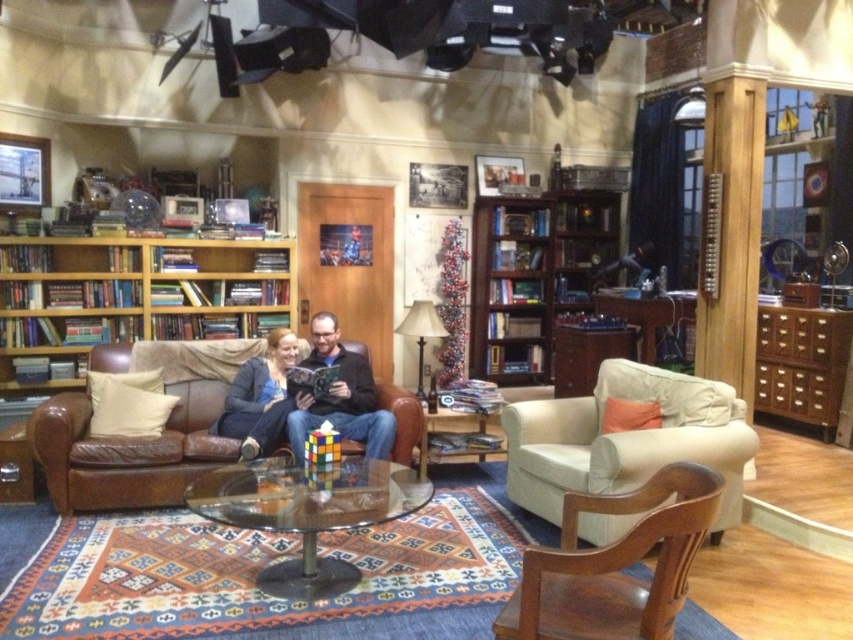
Question: Is brown leather couch at lower left below matte black sweater at left?

Choices:
 (A) yes
 (B) no

Answer: (A)

Question: Can you confirm if beige fabric armchair at center is positioned below light brown wood armchair at lower right?

Choices:
 (A) yes
 (B) no

Answer: (B)

Question: Based on their relative distances, which object is farther from the brown wooden bookcase at left?

Choices:
 (A) rubik's cube at center
 (B) beige fabric armchair at center
 (C) matte black sweater at left
 (D) brown leather couch at lower left

Answer: (B)

Question: Which object is positioned farthest from the beige fabric armchair at center?

Choices:
 (A) brown leather couch at lower left
 (B) matte black sweater at left
 (C) brown wooden bookcase at left

Answer: (C)

Question: Does light brown wood armchair at lower right have a lesser width compared to rubik's cube at center?

Choices:
 (A) no
 (B) yes

Answer: (B)

Question: Which point appears farthest from the camera in this image?

Choices:
 (A) (680, 570)
 (B) (80, 474)
 (C) (512, 252)
 (D) (717, 413)

Answer: (C)